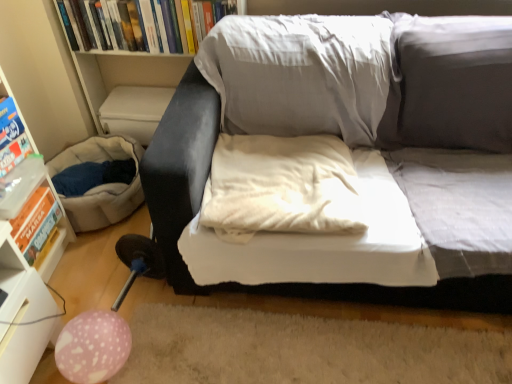
Question: Is pink dotted balloon at lower left spatially inside white plastic shelf at left, or outside of it?

Choices:
 (A) inside
 (B) outside

Answer: (B)

Question: Is pink dotted balloon at lower left to the left or to the right of white plastic shelf at left in the image?

Choices:
 (A) left
 (B) right

Answer: (B)

Question: Which object is the closest to the matte gray couch at center?

Choices:
 (A) pink dotted balloon at lower left
 (B) matte blue paperback book at left, which ranks as the second paperback book in top-to-bottom order
 (C) white soft pillow at center
 (D) hardcover book at upper center
 (E) white plastic shelf at left

Answer: (C)

Question: Based on their relative distances, which object is farther from the matte gray couch at center?

Choices:
 (A) beige fabric bean bag at lower left
 (B) hardcover book at upper center
 (C) white soft pillow at center
 (D) pink dotted balloon at lower left
 (E) orange cardboard book at left, the third paperback book from the top

Answer: (E)